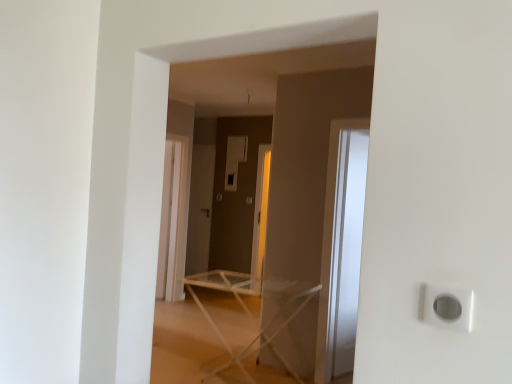
Question: Is matte gray screen door at center bigger or smaller than white plastic ironing board at center?

Choices:
 (A) small
 (B) big

Answer: (A)

Question: From a real-world perspective, is matte gray screen door at center above or below white plastic ironing board at center?

Choices:
 (A) below
 (B) above

Answer: (B)

Question: Which is nearer to the white plastic outlet at lower right?

Choices:
 (A) white plastic ironing board at center
 (B) transparent glass door at right
 (C) matte gray screen door at center

Answer: (A)

Question: Which object is the closest to the transparent glass door at right?

Choices:
 (A) matte gray screen door at center
 (B) white plastic ironing board at center
 (C) white plastic outlet at lower right

Answer: (B)